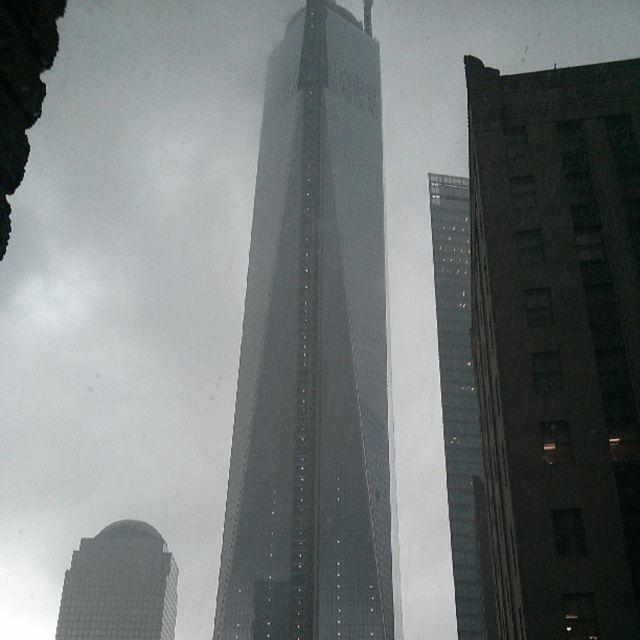
In the scene shown: You are a city planner analyzing the urban layout. Given that the glassy steel skyscraper at center and the transparent glass tower at center are both part of the same city block, which one has a greater horizontal footprint? Please base your answer on their widths as seen from this perspective.

The glassy steel skyscraper at center has a greater horizontal footprint because its width surpasses that of the transparent glass tower at center.

You are standing in front of the One World Trade Center and want to take a photo of the point at coordinates (449, 227). If your camera can focus up to 160 meters, will it be able to capture that point clearly?

The point at coordinates (449, 227) is 163.20 meters away from the camera, which exceeds the camera focus limit of 160 meters. Therefore, the camera will not be able to capture the point clearly.

You are a drone operator planning to fly a drone between the glassy steel skyscraper at center and the traditional highrise to its right. The drone has a maximum flight distance of 140 meters. Can the drone safely travel between them without exceeding its range?

The distance between the glassy steel skyscraper at center and the traditional highrise to its right is 138.46 meters, which is within the drone operator maximum flight distance of 140 meters. The drone can safely travel between them without exceeding its range.